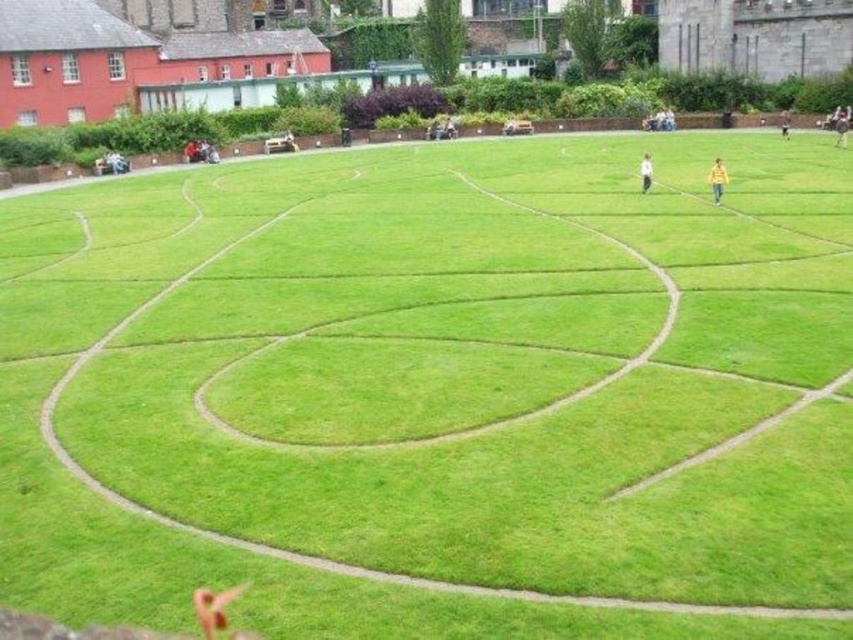
Question: In this image, where is yellow fabric person at right located relative to brown leather jacket at upper right?

Choices:
 (A) above
 (B) below

Answer: (B)

Question: Which point is closer to the camera taking this photo?

Choices:
 (A) (718, 188)
 (B) (840, 125)
 (C) (639, 170)

Answer: (A)

Question: Is yellow fabric person at center to the right of white fabric person at center from the viewer's perspective?

Choices:
 (A) no
 (B) yes

Answer: (B)

Question: Does white fabric person at center have a smaller size compared to yellow fabric person at right?

Choices:
 (A) yes
 (B) no

Answer: (B)

Question: Based on their relative distances, which object is farther from the yellow fabric person at center?

Choices:
 (A) brown leather jacket at upper right
 (B) yellow fabric person at right

Answer: (A)

Question: Which point is closer to the camera?

Choices:
 (A) brown leather jacket at upper right
 (B) yellow fabric person at right
 (C) yellow fabric person at center

Answer: (C)